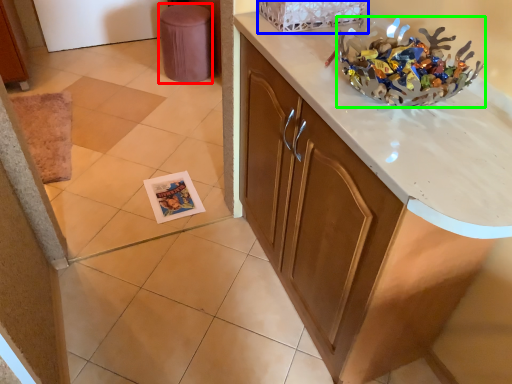
Question: Based on their relative distances, which object is nearer to stool (highlighted by a red box)? Choose from basket (highlighted by a blue box) and stuff (highlighted by a green box).

Choices:
 (A) basket
 (B) stuff

Answer: (A)